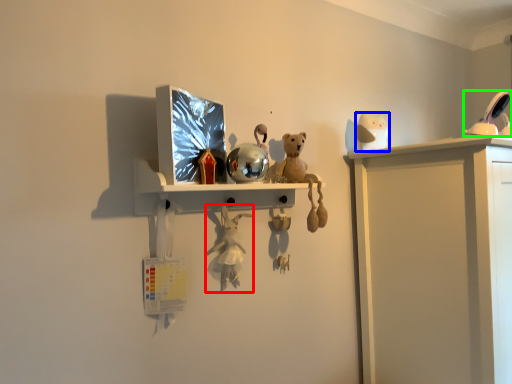
Question: Which object is the closest to the toy (highlighted by a red box)? Choose among these: toy (highlighted by a blue box) or toy (highlighted by a green box).

Choices:
 (A) toy
 (B) toy

Answer: (A)